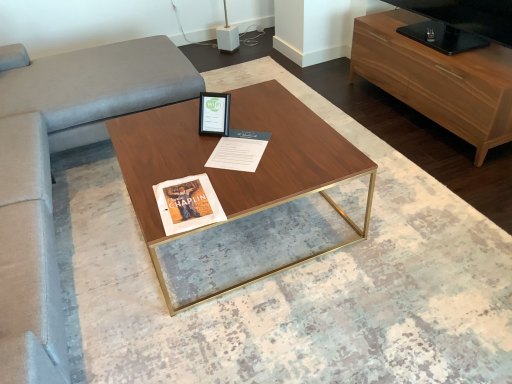
Locate an element on the screen. free space above walnut wood coffee table at center (from a real-world perspective) is located at coordinates (224, 139).